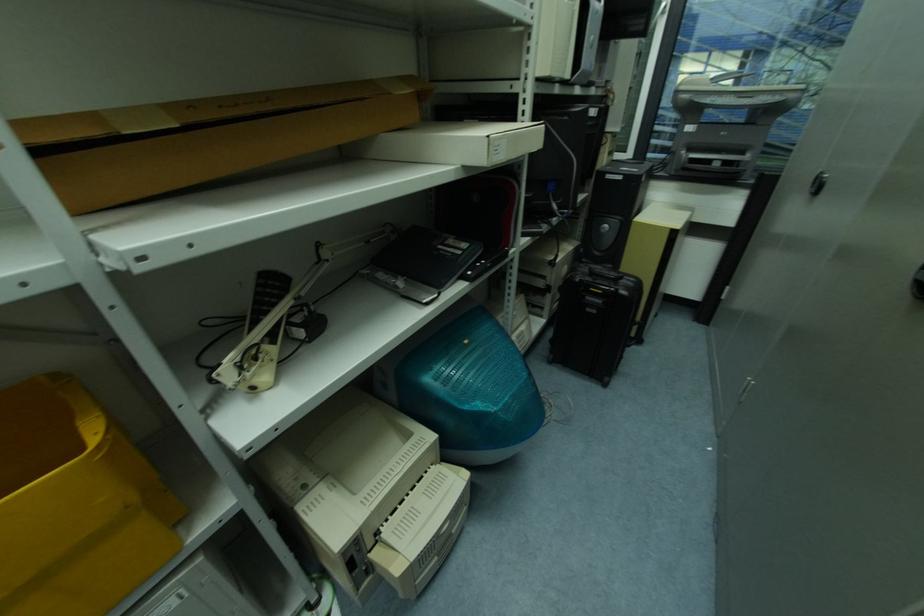
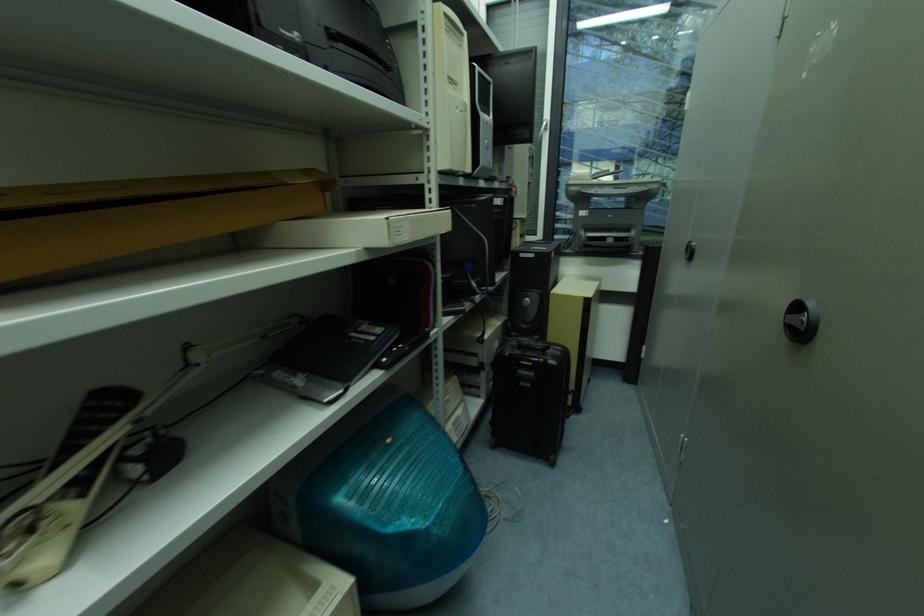
In a continuous first-person perspective shot, in which direction is the camera moving?

The movement direction of the cameraman is right, forward.